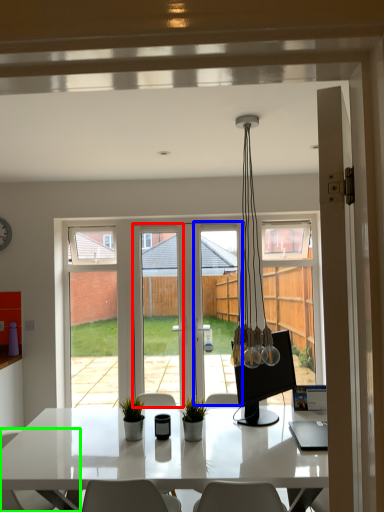
Question: Which object is the closest to the screen door (highlighted by a red box)? Choose among these: screen door (highlighted by a blue box) or chair (highlighted by a green box).

Choices:
 (A) screen door
 (B) chair

Answer: (A)